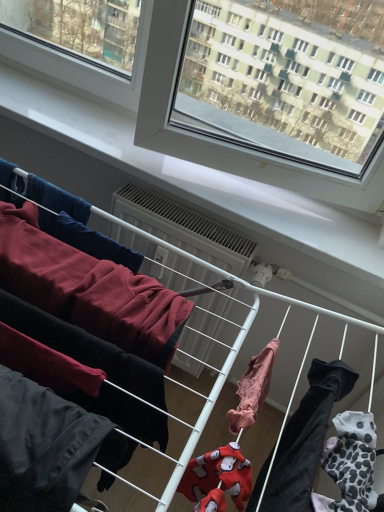
Question: Is light pink fabric at center, the first clothing viewed from the right, wider or thinner than dark gray cotton pants at lower left, the first clothing from the left?

Choices:
 (A) wide
 (B) thin

Answer: (A)

Question: Would you say light pink fabric at center, the first clothing viewed from the right, is inside or outside dark gray cotton pants at lower left, positioned as the third clothing in right-to-left order?

Choices:
 (A) inside
 (B) outside

Answer: (B)

Question: Which object is positioned farthest from the light pink fabric at center, the first clothing viewed from the right?

Choices:
 (A) dark gray cotton pants at lower left, the first clothing from the left
 (B) white plastic air conditioner at center
 (C) dark red fleece sweatshirt at left, arranged as the second clothing when viewed from the left

Answer: (B)

Question: Estimate the real-world distances between objects in this image. Which object is closer to the dark red fleece sweatshirt at left, arranged as the second clothing when viewed from the left?

Choices:
 (A) dark gray cotton pants at lower left, positioned as the third clothing in right-to-left order
 (B) light pink fabric at center, arranged as the third clothing when viewed from the left
 (C) white plastic air conditioner at center

Answer: (A)